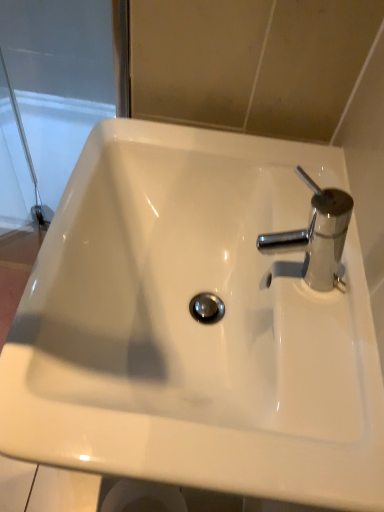
You are a GUI agent. You are given a task and a screenshot of the screen. Output one action in this format:
    pyautogui.click(x=<x>, y=<y>)
    Task: Click on the vacant area on the back side of chrome metallic faucet at upper right
    
    Given the screenshot: What is the action you would take?
    pyautogui.click(x=270, y=199)